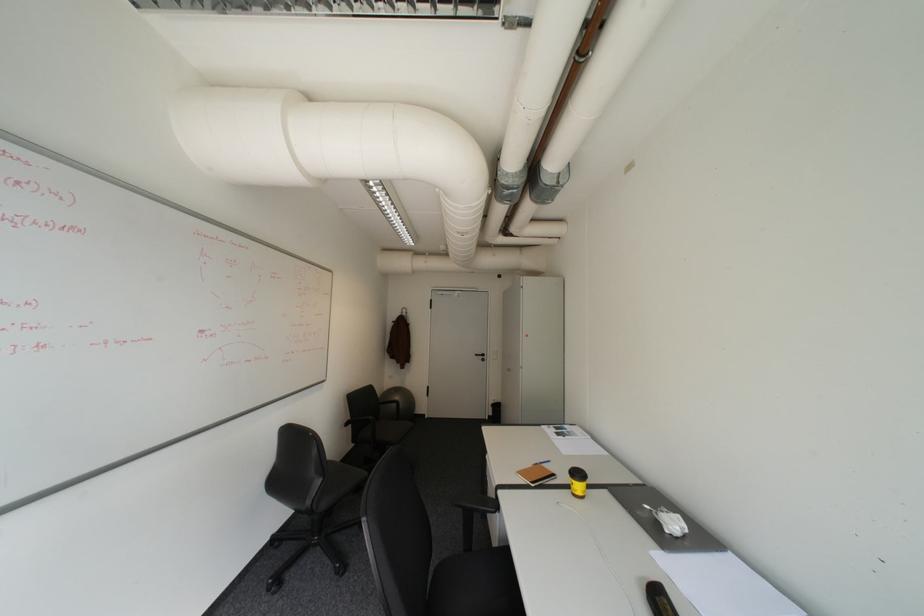
Where would you sit the black chair sitting surface? Please return your answer as a coordinate pair (x, y).

(473, 590)